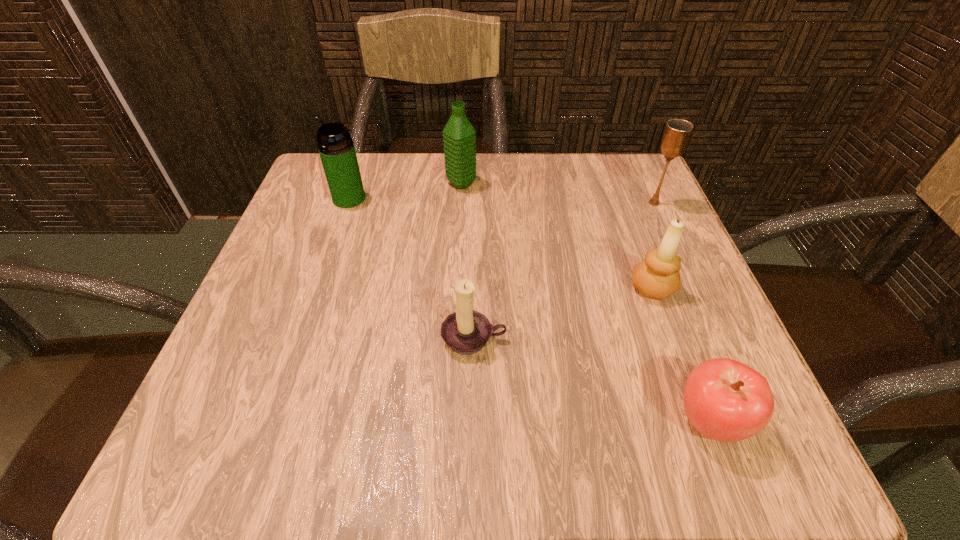
The height and width of the screenshot is (540, 960). In order to click on free area in between the third nearest object and the water bottle in this screenshot , I will do `click(557, 235)`.

Find the location of a particular element. vacant area that lies between the nearer candle holder and the water bottle is located at coordinates (468, 261).

Image resolution: width=960 pixels, height=540 pixels. I want to click on empty space that is in between the chalice and the fifth farthest object, so click(x=564, y=271).

Identify the location of free space between the nearer candle holder and the apple. (591, 380).

Where is `empty space between the shorter candle holder and the water bottle`? This screenshot has width=960, height=540. empty space between the shorter candle holder and the water bottle is located at coordinates (468, 261).

The width and height of the screenshot is (960, 540). I want to click on vacant point located between the chalice and the leftmost object, so click(x=501, y=201).

Identify the location of empty space between the thermos bottle and the nearer candle holder. (412, 269).

At what (x,y) coordinates should I click in order to perform the action: click on vacant area that lies between the nearer candle holder and the apple. Please return your answer as a coordinate pair (x, y). This screenshot has height=540, width=960. Looking at the image, I should click on (591, 380).

Where is `free space between the chalice and the right candle holder`? The height and width of the screenshot is (540, 960). free space between the chalice and the right candle holder is located at coordinates (653, 245).

Where is `free area in between the fifth farthest object and the water bottle`? free area in between the fifth farthest object and the water bottle is located at coordinates (468, 261).